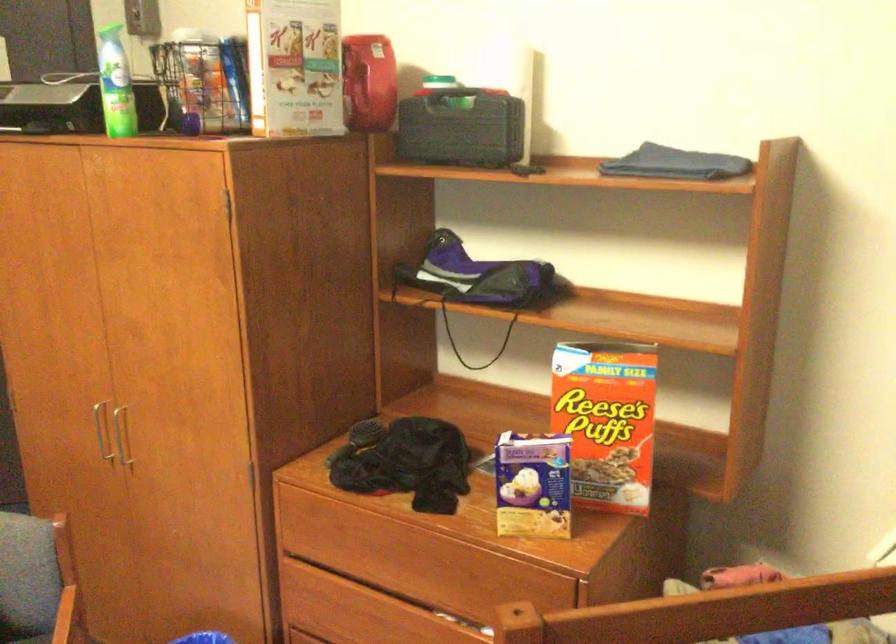
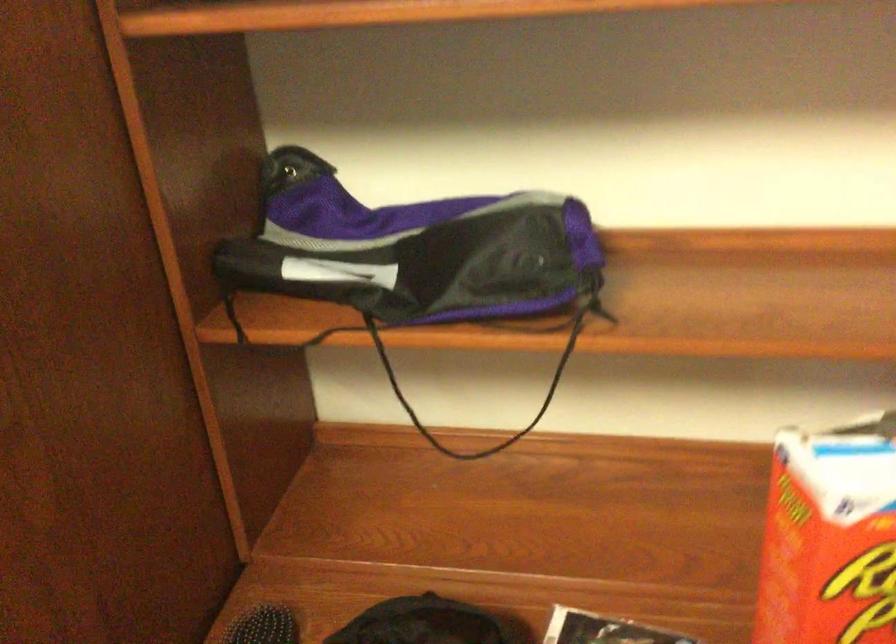
Question: Which direction would the cameraman need to move to produce the second image? Reply with the corresponding letter.

Choices:
 (A) Left
 (B) Right
 (C) Forward
 (D) Backward

Answer: (C)